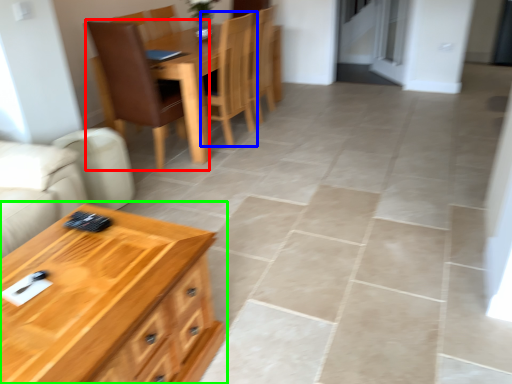
Question: Which object is the farthest from chair (highlighted by a red box)? Choose among these: chair (highlighted by a blue box) or table (highlighted by a green box).

Choices:
 (A) chair
 (B) table

Answer: (B)